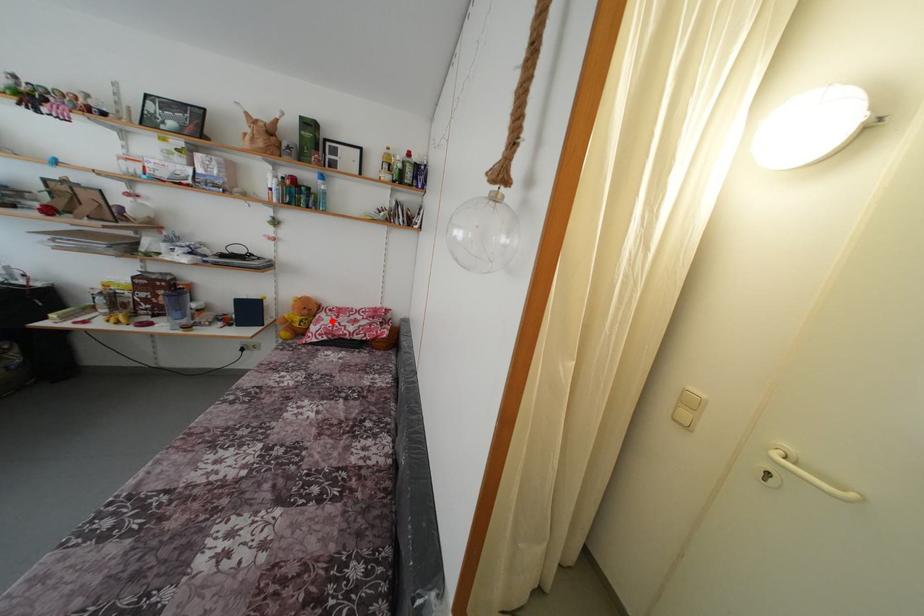
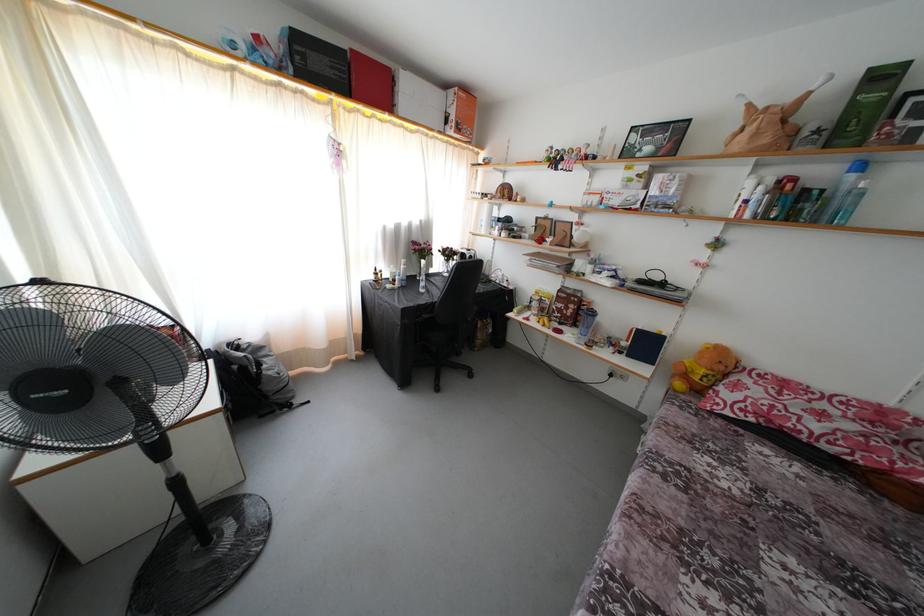
The point at the highlighted location is marked in the first image. Where is the corresponding point in the second image?

(760, 389)